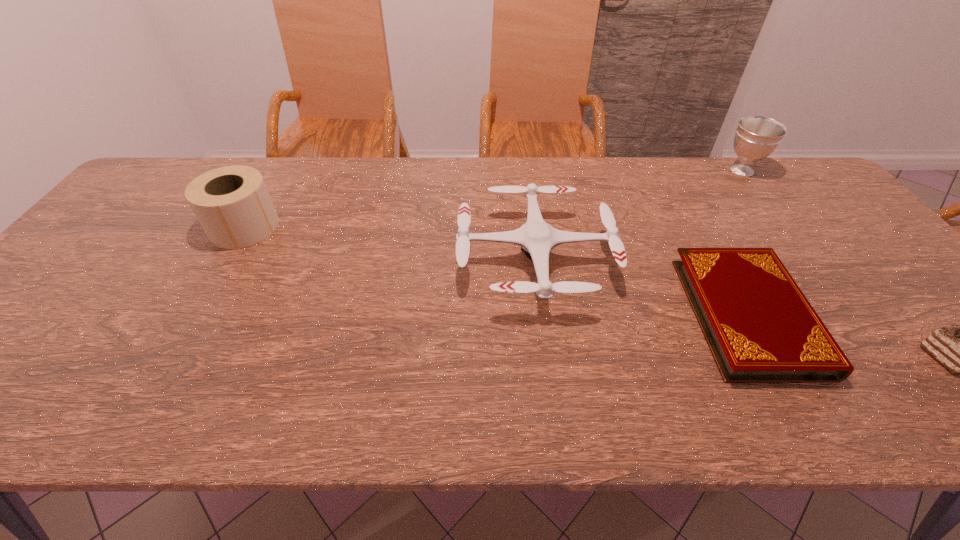
The height and width of the screenshot is (540, 960). What are the coordinates of `vacant area located 0.070m with the camera attached at the bottom of the fourth object from right to left` in the screenshot? It's located at (430, 259).

Locate an element on the screen. This screenshot has height=540, width=960. vacant region located with the camera attached at the bottom of the fourth object from right to left is located at coordinates (334, 259).

I want to click on object positioned at the far edge, so pos(756,137).

This screenshot has width=960, height=540. What are the coordinates of `object positioned at the near edge` in the screenshot? It's located at (760, 328).

Where is `object at the right edge`? object at the right edge is located at coordinates [x=756, y=137].

You are a GUI agent. You are given a task and a screenshot of the screen. Output one action in this format:
    pyautogui.click(x=<x>, y=<y>)
    Task: Click on the object that is at the far right corner
    
    Given the screenshot: What is the action you would take?
    pyautogui.click(x=756, y=137)

Identify the location of vacant space at the far edge. Image resolution: width=960 pixels, height=540 pixels. (697, 171).

In the image, there is a desktop. Where is `free region at the left edge`? The height and width of the screenshot is (540, 960). free region at the left edge is located at coordinates (154, 221).

Where is `vacant space at the right edge of the desktop`? Image resolution: width=960 pixels, height=540 pixels. vacant space at the right edge of the desktop is located at coordinates (864, 265).

Locate an element on the screen. free space between the leftmost object and the drone is located at coordinates (390, 244).